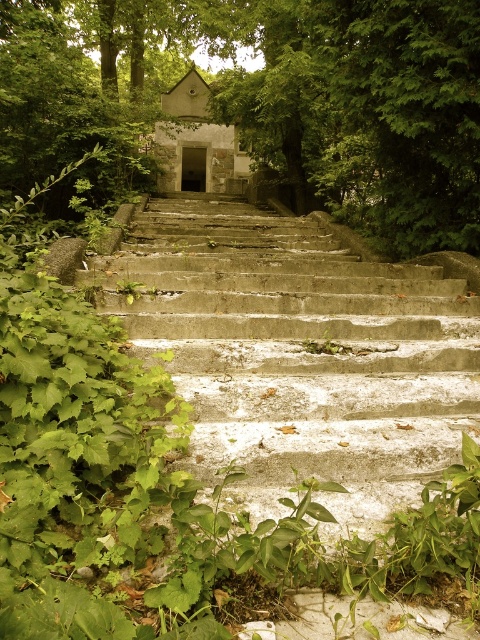
You are standing at the base of the stone steps leading to the rustic structure. You need to locate the green leafy tree at center. According to the coordinates provided, where should you look relative to the steps?

The green leafy tree at center is located at coordinates point (x=264, y=100), which means it is positioned to the left side of the steps, closer to the dense foliage area described in the scene.

You are standing at the bottom of the concrete stairs at center and want to reach the top. As you climb, will the green leafy tree at center come into your view above you?

Yes, the green leafy tree at center is above the concrete stairs at center, so as you climb the stairs, the tree will come into view above you.

You are standing at the bottom of the concrete stairs at center and want to reach the top. To your left, there is a green leafy tree at center. Which direction should you walk to avoid the tree and reach the stairs?

The green leafy tree at center is on the left side of the concrete stairs at center, so you should walk to the right to avoid the tree and reach the stairs.